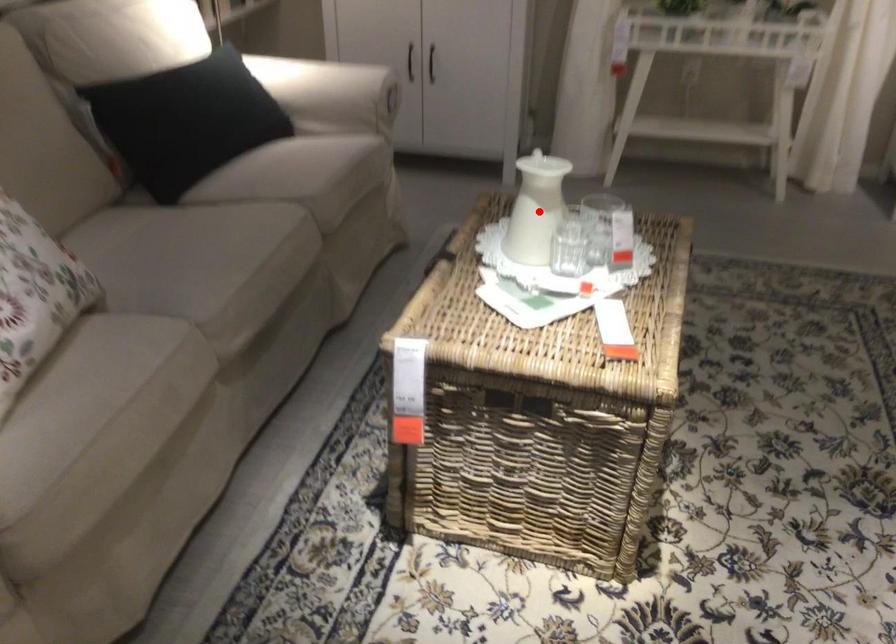
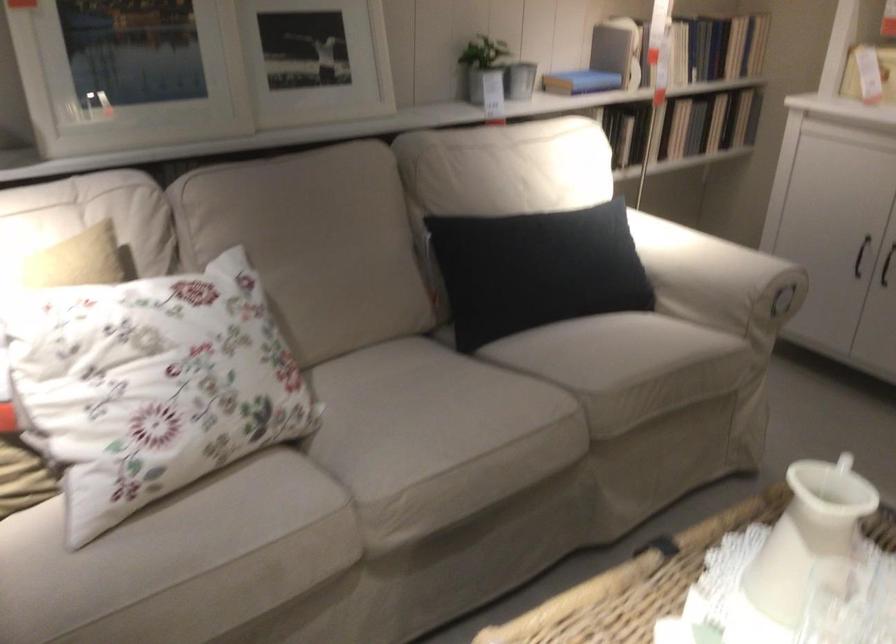
Question: I am providing you with two images of the same scene from different viewpoints. A red point is shown in image1. For the corresponding object point in image2, is it positioned nearer or farther from the camera?

Choices:
 (A) Nearer
 (B) Farther

Answer: (A)